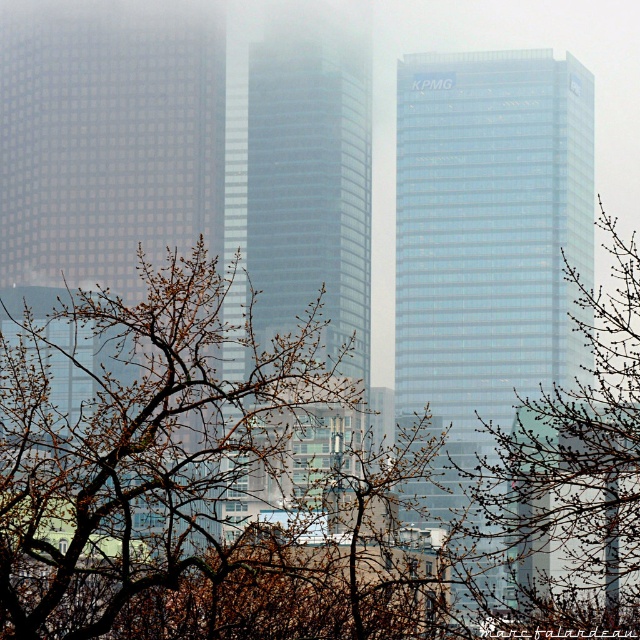
You are standing in the city scene and want to locate the point at coordinates point (106, 141). Based on the scene description, where would you find this point?

The point (106, 141) is on the matte glass skyscraper at left.

You are standing in the city park and see the matte glass skyscraper at left and the glassy blue skyscraper at center. Which building is closer to you?

The matte glass skyscraper at left is closer to you because it is positioned in front of the glassy blue skyscraper at center.